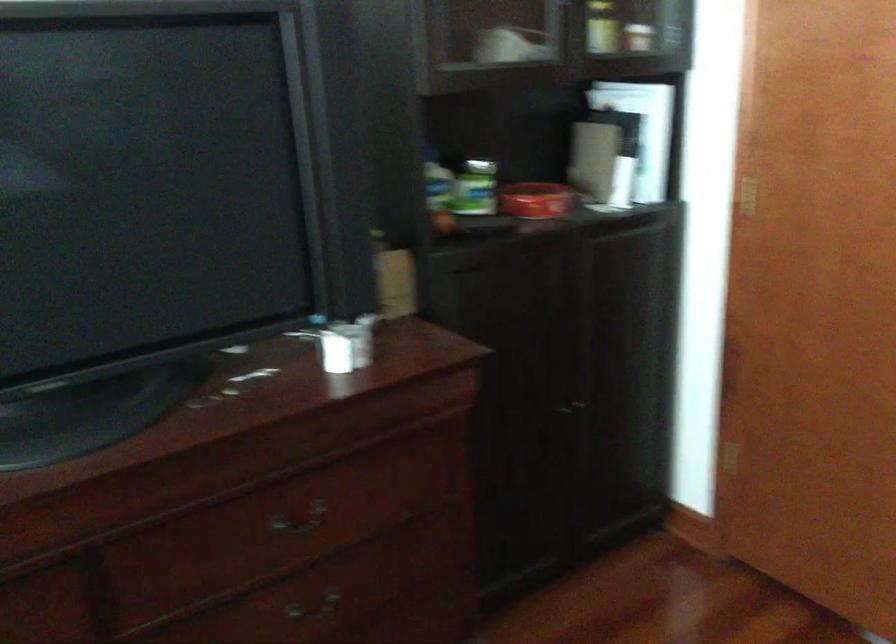
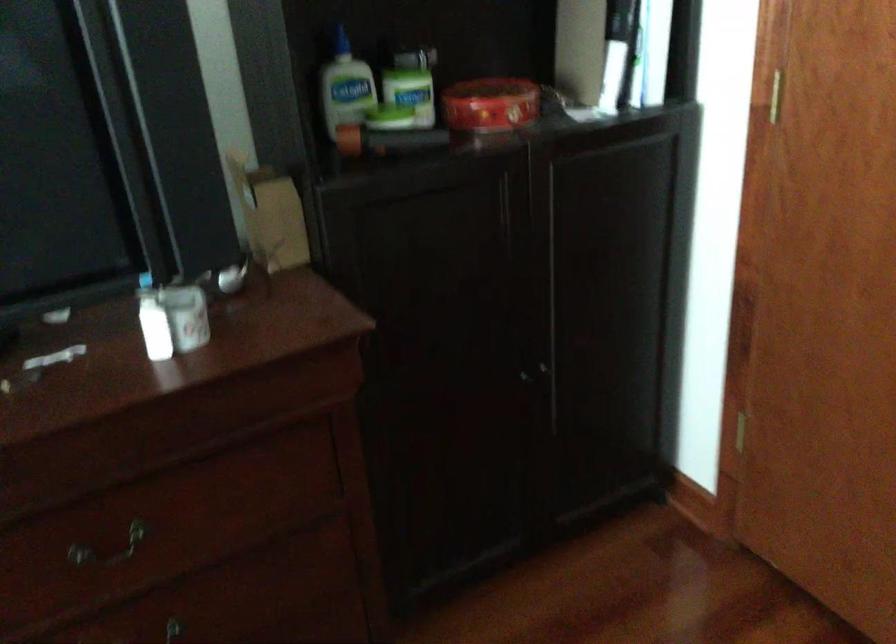
In a continuous first-person perspective shot, in which direction is the camera moving?

The movement direction of the cameraman is right, forward.